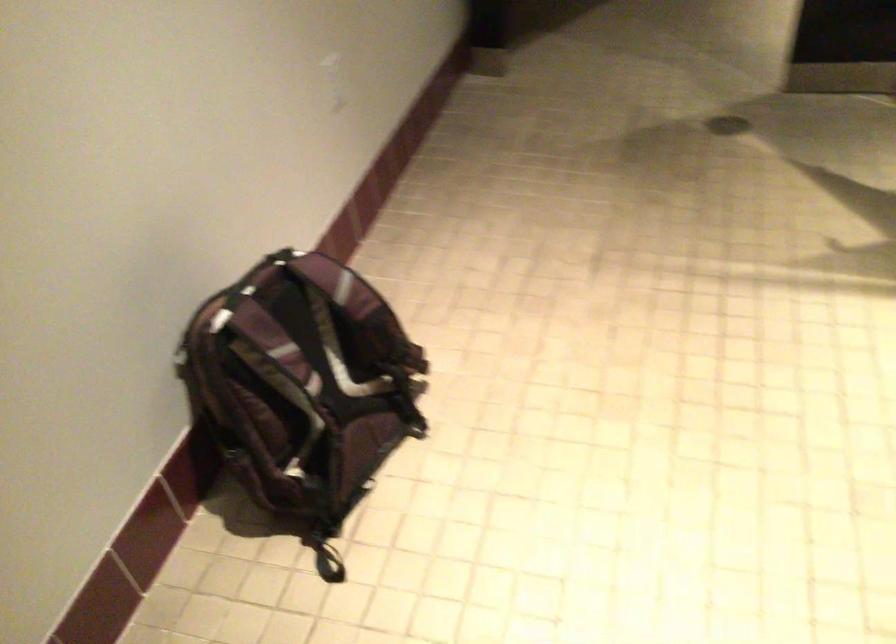
Describe the element at coordinates (328, 567) in the screenshot. This screenshot has width=896, height=644. I see `a backpack bottom loop` at that location.